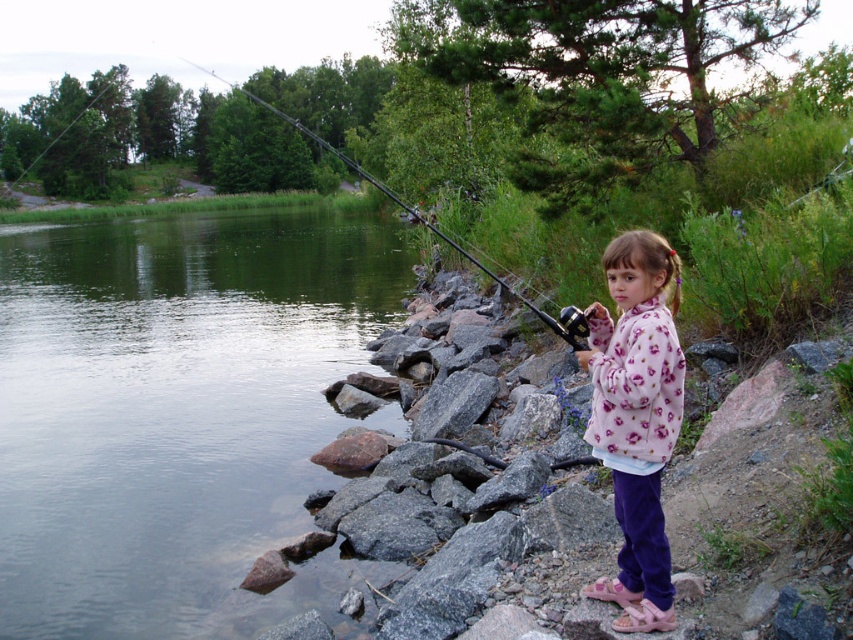
You are a fashion designer observing the lakeside scene and want to create a new line of outdoor apparel. You notice the fluffy pink sweater at right and the black metallic fishing pole at upper center. Which item has a smaller width?

The fluffy pink sweater at right has a smaller width than the black metallic fishing pole at upper center.